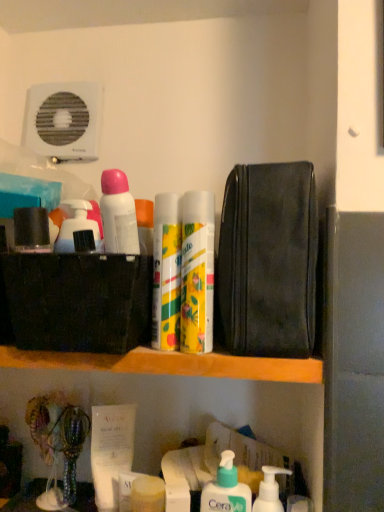
Image resolution: width=384 pixels, height=512 pixels. What do you see at coordinates (197, 272) in the screenshot? I see `yellow matte can at center, which is counted as the first cleaning product, starting from the top` at bounding box center [197, 272].

Where is `yellow matte can at center, the 1th cleaning product when ordered from left to right`? The height and width of the screenshot is (512, 384). yellow matte can at center, the 1th cleaning product when ordered from left to right is located at coordinates (197, 272).

What do you see at coordinates (148, 494) in the screenshot?
I see `matte yellow soap at lower center, the first toiletry positioned from the bottom` at bounding box center [148, 494].

I want to click on matte black container at upper left, which ranks as the 5th toiletry in right-to-left order, so click(31, 230).

Where is `yellow matte can at center, the 3th toiletry when ordered from top to bottom`? The width and height of the screenshot is (384, 512). yellow matte can at center, the 3th toiletry when ordered from top to bottom is located at coordinates (166, 272).

How much distance is there between yellow matte can at center, arranged as the second cleaning product when viewed from the right, and yellow matte can at center, the 3th toiletry when ordered from top to bottom?

yellow matte can at center, arranged as the second cleaning product when viewed from the right, is 1.36 inches away from yellow matte can at center, the 3th toiletry when ordered from top to bottom.

Where is `the 1st toiletry to the left of the yellow matte can at center, which is counted as the first cleaning product, starting from the top, counting from the anchor's position`? The height and width of the screenshot is (512, 384). the 1st toiletry to the left of the yellow matte can at center, which is counted as the first cleaning product, starting from the top, counting from the anchor's position is located at coordinates click(x=166, y=272).

Is yellow matte can at center, the 2th cleaning product ordered from the bottom, completely or partially outside of yellow matte can at center, the 3th toiletry when ordered from top to bottom?

yellow matte can at center, the 2th cleaning product ordered from the bottom, lies outside yellow matte can at center, the 3th toiletry when ordered from top to bottom,'s area.

Which object is closer to the camera taking this photo, yellow matte can at center, arranged as the second cleaning product when viewed from the right, or yellow matte can at center, the 3th toiletry when ordered from top to bottom?

Positioned in front is yellow matte can at center, arranged as the second cleaning product when viewed from the right.

From a real-world perspective, between white pump bottle at lower center, the 5th toiletry when ordered from left to right, and matte yellow soap at lower center, the third toiletry in the right-to-left sequence, who is vertically higher?

white pump bottle at lower center, the 5th toiletry when ordered from left to right, is physically above.

Could you tell me if white pump bottle at lower center, which is the second toiletry from bottom to top, is facing matte yellow soap at lower center, the third toiletry in the right-to-left sequence?

No, white pump bottle at lower center, which is the second toiletry from bottom to top, is not oriented towards matte yellow soap at lower center, the third toiletry in the right-to-left sequence.

From the image's perspective, which one is positioned lower, white pump bottle at lower center, the 1th toiletry viewed from the right, or matte yellow soap at lower center, acting as the 3th toiletry starting from the left?

matte yellow soap at lower center, acting as the 3th toiletry starting from the left, is shown below in the image.

Considering the relative sizes of white pump bottle at lower center, the 1th toiletry viewed from the right, and matte yellow soap at lower center, acting as the 3th toiletry starting from the left, in the image provided, is white pump bottle at lower center, the 1th toiletry viewed from the right, shorter than matte yellow soap at lower center, acting as the 3th toiletry starting from the left,?

No, white pump bottle at lower center, the 1th toiletry viewed from the right, is not shorter than matte yellow soap at lower center, acting as the 3th toiletry starting from the left.

Does point (271, 510) lie in front of point (33, 220)?

No, it is behind (33, 220).

Considering the positions of objects white pump bottle at lower center, acting as the second cleaning product starting from the left, and matte black container at upper left, the second toiletry viewed from the top, in the image provided, who is more to the right, white pump bottle at lower center, acting as the second cleaning product starting from the left, or matte black container at upper left, the second toiletry viewed from the top,?

white pump bottle at lower center, acting as the second cleaning product starting from the left.

Which is behind, white pump bottle at lower center, the 2th cleaning product from the top, or matte black container at upper left, arranged as the first toiletry when viewed from the left?

white pump bottle at lower center, the 2th cleaning product from the top.

In terms of height, does white pump bottle at lower center, the 2th cleaning product from the top, look taller or shorter compared to matte black container at upper left, arranged as the first toiletry when viewed from the left?

white pump bottle at lower center, the 2th cleaning product from the top, is taller than matte black container at upper left, arranged as the first toiletry when viewed from the left.

Can you see yellow matte can at center, the 3th toiletry ordered from the bottom, touching matte black container at upper left, the fourth toiletry in the bottom-to-top sequence?

No, yellow matte can at center, the 3th toiletry ordered from the bottom, is not next to matte black container at upper left, the fourth toiletry in the bottom-to-top sequence.

Looking at the image, does yellow matte can at center, which appears as the fourth toiletry when viewed from the left, seem bigger or smaller compared to matte black container at upper left, the fourth toiletry in the bottom-to-top sequence?

yellow matte can at center, which appears as the fourth toiletry when viewed from the left, is bigger than matte black container at upper left, the fourth toiletry in the bottom-to-top sequence.

From a real-world perspective, who is located higher, yellow matte can at center, the 3th toiletry when ordered from top to bottom, or matte black container at upper left, the second toiletry viewed from the top?

In real-world perspective, matte black container at upper left, the second toiletry viewed from the top, is above.

From a real-world perspective, is wooden shelf at center above or below matte yellow soap at lower center, acting as the 3th toiletry starting from the left?

In terms of real-world spatial position, wooden shelf at center is above matte yellow soap at lower center, acting as the 3th toiletry starting from the left.

Looking at this image, what's the angular difference between wooden shelf at center and matte yellow soap at lower center, acting as the 3th toiletry starting from the left,'s facing directions?

2.4 degrees separate the facing orientations of wooden shelf at center and matte yellow soap at lower center, acting as the 3th toiletry starting from the left.

Is wooden shelf at center shorter than matte yellow soap at lower center, acting as the 3th toiletry starting from the left?

Yes.

Does point (264, 492) come in front of point (249, 507)?

That is False.

Is white pump bottle at lower center, acting as the second cleaning product starting from the left, turned away from white pump bottle at lower center, placed as the fourth toiletry when sorted from top to bottom?

No.

What's the angular difference between white pump bottle at lower center, arranged as the 1th cleaning product when ordered from the bottom, and white pump bottle at lower center, placed as the fourth toiletry when sorted from top to bottom,'s facing directions?

0.00423 degrees separate the facing orientations of white pump bottle at lower center, arranged as the 1th cleaning product when ordered from the bottom, and white pump bottle at lower center, placed as the fourth toiletry when sorted from top to bottom.

From a real-world perspective, which object rests below the other?

In real-world perspective, white pump bottle at lower center, which is the 1th cleaning product in right-to-left order, is lower.

Is matte black container at upper left, the fourth toiletry in the bottom-to-top sequence, far away from white pump bottle at lower center, the 2th cleaning product from the top?

That's not correct — matte black container at upper left, the fourth toiletry in the bottom-to-top sequence, is a little close to white pump bottle at lower center, the 2th cleaning product from the top.

Does matte black container at upper left, which ranks as the 5th toiletry in right-to-left order, have a larger size compared to white pump bottle at lower center, the 2th cleaning product from the top?

Actually, matte black container at upper left, which ranks as the 5th toiletry in right-to-left order, might be smaller than white pump bottle at lower center, the 2th cleaning product from the top.

Which object is more forward, matte black container at upper left, the fourth toiletry in the bottom-to-top sequence, or white pump bottle at lower center, the 2th cleaning product from the top?

matte black container at upper left, the fourth toiletry in the bottom-to-top sequence.

From a real-world perspective, count 1st toiletrys downward from the yellow matte can at center, the 1th cleaning product when ordered from left to right, and point to it. Please provide its 2D coordinates.

[(166, 272)]

Locate an element on the screen. This screenshot has height=512, width=384. toiletry behind the white pump bottle at lower center, the 5th toiletry when ordered from left to right is located at coordinates (148, 494).

Based on their spatial positions, is matte black container at upper left, the fourth toiletry in the bottom-to-top sequence, or yellow matte can at center, which is counted as the first cleaning product, starting from the top, further from yellow matte can at center, the 3th toiletry when ordered from top to bottom?

Based on the image, matte black container at upper left, the fourth toiletry in the bottom-to-top sequence, appears to be further to yellow matte can at center, the 3th toiletry when ordered from top to bottom.

Based on their spatial positions, is white pump bottle at lower center, placed as the fourth toiletry when sorted from top to bottom, or white matte deodorant at upper left, marked as the fourth toiletry in a right-to-left arrangement, closer to matte black container at upper left, the fourth toiletry in the bottom-to-top sequence?

Among the two, white matte deodorant at upper left, marked as the fourth toiletry in a right-to-left arrangement, is located nearer to matte black container at upper left, the fourth toiletry in the bottom-to-top sequence.

From the image, which object appears to be farther from yellow matte can at center, the 1th cleaning product when ordered from left to right, black leather pouch at upper right or white pump bottle at lower center, acting as the second cleaning product starting from the left?

white pump bottle at lower center, acting as the second cleaning product starting from the left.

Considering their positions, is yellow matte can at center, which is counted as the first cleaning product, starting from the top, positioned closer to white pump bottle at lower center, which is the second toiletry from bottom to top, than black leather pouch at upper right?

The object closer to white pump bottle at lower center, which is the second toiletry from bottom to top, is yellow matte can at center, which is counted as the first cleaning product, starting from the top.

Considering their positions, is white matte deodorant at upper left, which ranks as the 2th toiletry in left-to-right order, positioned further to matte black container at upper left, the second toiletry viewed from the top, than black leather pouch at upper right?

black leather pouch at upper right.

Looking at the image, which one is located further to white matte deodorant at upper left, marked as the fourth toiletry in a right-to-left arrangement, matte yellow soap at lower center, the third toiletry in the right-to-left sequence, or white pump bottle at lower center, arranged as the 1th cleaning product when ordered from the bottom?

white pump bottle at lower center, arranged as the 1th cleaning product when ordered from the bottom, is positioned further to the anchor white matte deodorant at upper left, marked as the fourth toiletry in a right-to-left arrangement.

Looking at the image, which one is located closer to white matte deodorant at upper left, which ranks as the 2th toiletry in left-to-right order, yellow matte can at center, the 1th cleaning product when ordered from left to right, or white pump bottle at lower center, acting as the second cleaning product starting from the left?

yellow matte can at center, the 1th cleaning product when ordered from left to right.

In the scene shown: Estimate the real-world distances between objects in this image. Which object is further from white pump bottle at lower center, which is the 1th cleaning product in right-to-left order, matte black container at upper left, the fourth toiletry in the bottom-to-top sequence, or matte yellow soap at lower center, acting as the 3th toiletry starting from the left?

matte black container at upper left, the fourth toiletry in the bottom-to-top sequence, is further to white pump bottle at lower center, which is the 1th cleaning product in right-to-left order.

This screenshot has height=512, width=384. What are the coordinates of `pouch between white matte deodorant at upper left, which ranks as the 2th toiletry in left-to-right order, and matte yellow soap at lower center, the third toiletry in the right-to-left sequence, in the vertical direction` in the screenshot? It's located at (267, 261).

I want to click on shelf located between matte black container at upper left, the second toiletry viewed from the top, and yellow matte can at center, the 1th cleaning product when ordered from left to right, in the left-right direction, so click(170, 364).

Find the location of a particular element. shelf situated between matte black container at upper left, the fourth toiletry in the bottom-to-top sequence, and black leather pouch at upper right from left to right is located at coordinates (170, 364).

The image size is (384, 512). I want to click on cleaning product between matte black container at upper left, the fourth toiletry in the bottom-to-top sequence, and black leather pouch at upper right, so click(x=197, y=272).